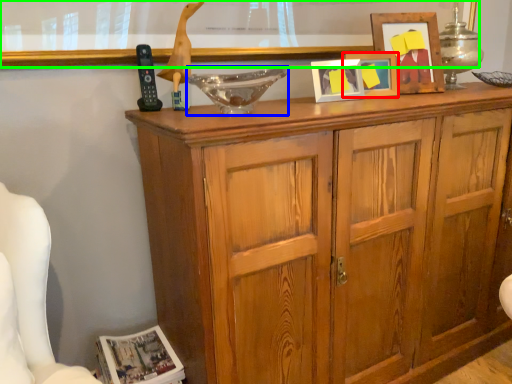
Question: Considering the real-world distances, which object is farthest from picture frame (highlighted by a red box)? glass bowl (highlighted by a blue box) or bulletin board (highlighted by a green box)?

Choices:
 (A) glass bowl
 (B) bulletin board

Answer: (A)